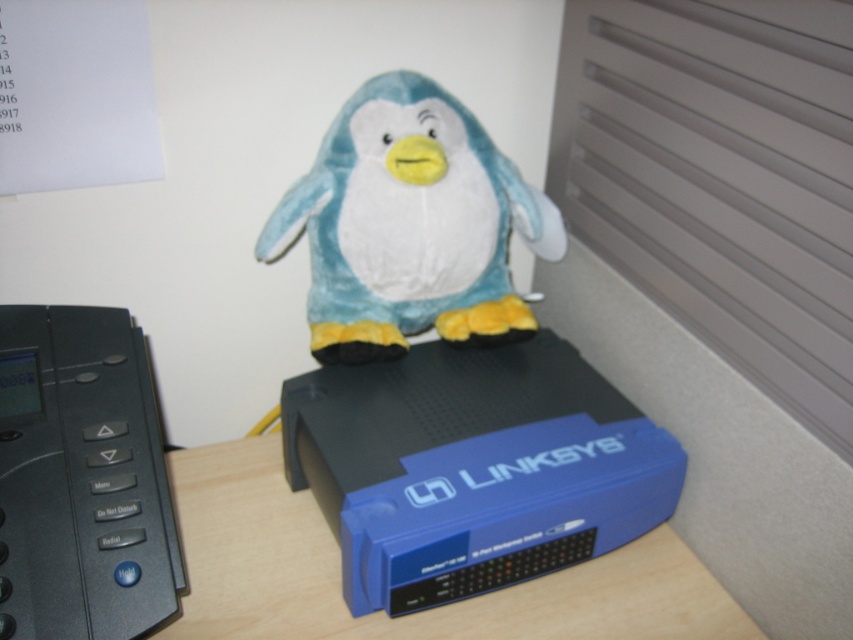
You are setting up a home office and want to place the black plastic phone at left and the blue plastic router at center on a narrow shelf. The shelf can only hold items that are no thicker than 3 centimeters. Based on the scene description, will both items fit on the shelf?

The black plastic phone at left is thinner than the blue plastic router at center. However, since the router is at the center and the phone is thinner, we cannot confirm if the router is within the 3 cm thickness limit. More information is needed.

You are a delivery robot trying to place a package on the Linksys router. The package requires a minimum of 10 cm of space from the edge of the router to avoid interference. Given the soft plush penguin at center is currently occupying the center, can you place the package on the router without moving the penguin?

The soft plush penguin at center is located at point (410, 225), which is the center of the router. Since the package needs at least 10 cm from the edge, placing it at the center would be too close to the edges. Therefore, the package cannot be placed without moving the penguin.

You are setting up a new router and see the soft plush penguin at center and the black plastic phone at left. Which object is positioned to the left side of the other?

The soft plush penguin at center is to the right of the black plastic phone at left, so the black plastic phone at left is positioned to the left side of the soft plush penguin at center.